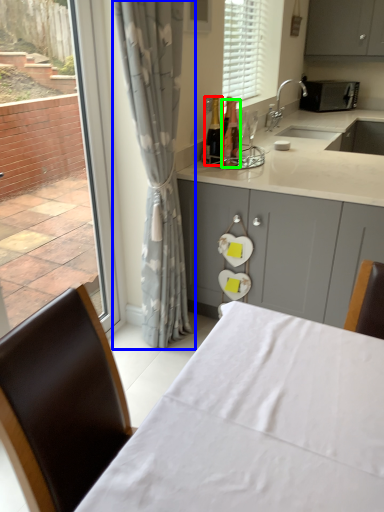
Question: Based on their relative distances, which object is farther from bottle (highlighted by a red box)? Choose from curtain (highlighted by a blue box) and bottle (highlighted by a green box).

Choices:
 (A) curtain
 (B) bottle

Answer: (A)